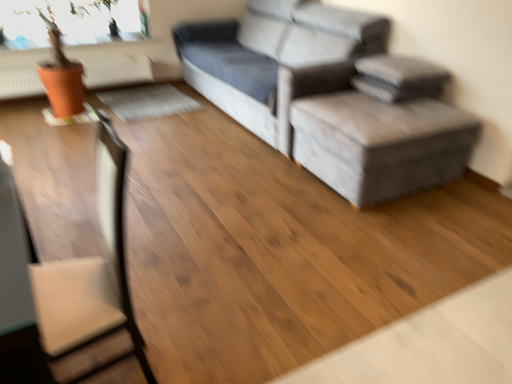
Question: From a real-world perspective, is orange matte radiator at upper left physically located above or below gray fabric ottoman at center?

Choices:
 (A) above
 (B) below

Answer: (B)

Question: Visually, is orange matte radiator at upper left positioned to the left or to the right of gray fabric ottoman at center?

Choices:
 (A) left
 (B) right

Answer: (A)

Question: Based on their relative distances, which object is farther from the brown leather swivel chair at left?

Choices:
 (A) gray fabric couch at upper right
 (B) orange matte radiator at upper left
 (C) gray fabric ottoman at center

Answer: (B)

Question: Considering the real-world distances, which object is closest to the gray fabric ottoman at center?

Choices:
 (A) brown leather swivel chair at left
 (B) orange matte radiator at upper left
 (C) gray fabric couch at upper right

Answer: (C)